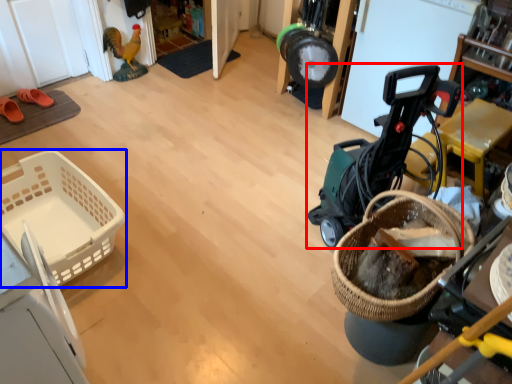
Question: Among these objects, which one is farthest to the camera, baby carriage (highlighted by a red box) or basket (highlighted by a blue box)?

Choices:
 (A) baby carriage
 (B) basket

Answer: (B)